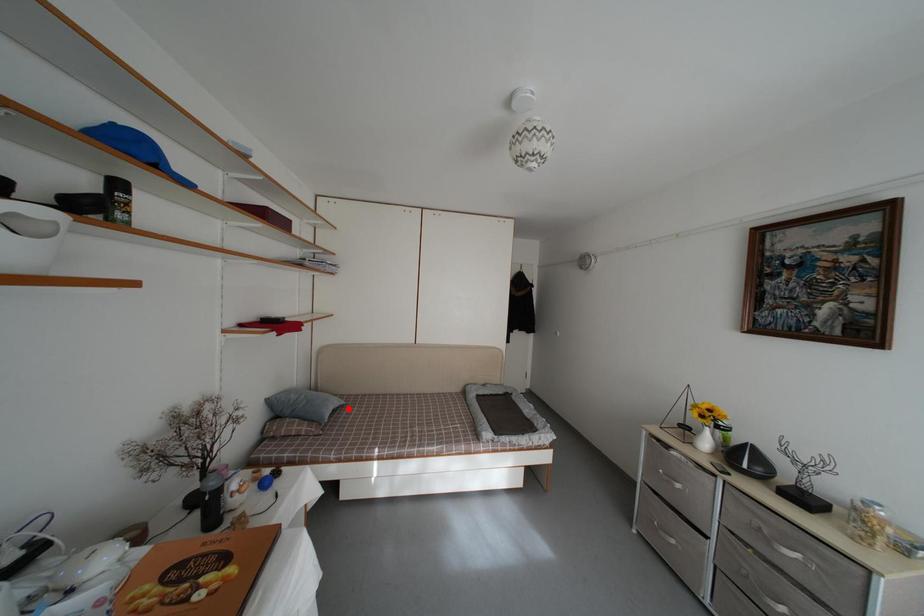
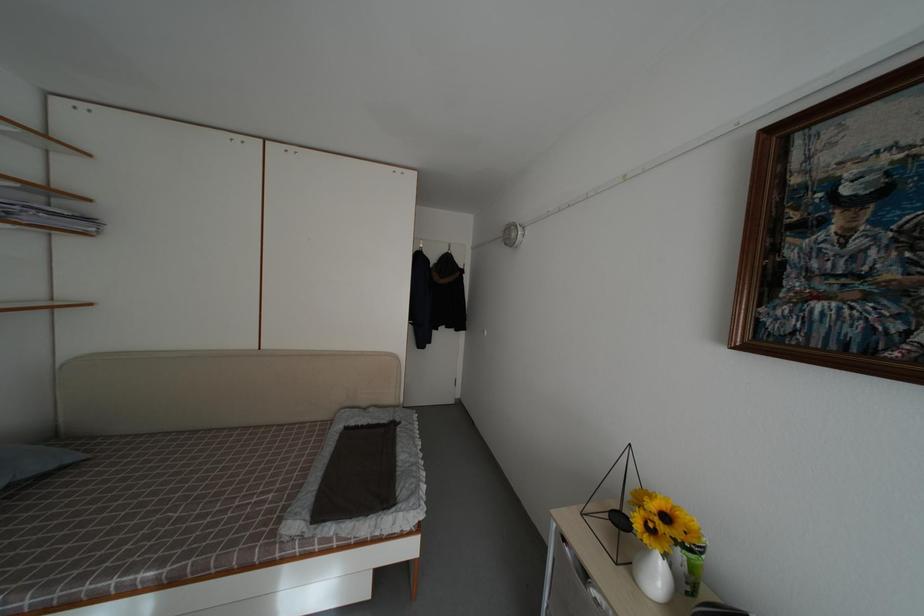
Find the pixel in the second image that matches the highlighted location in the first image.

(80, 464)